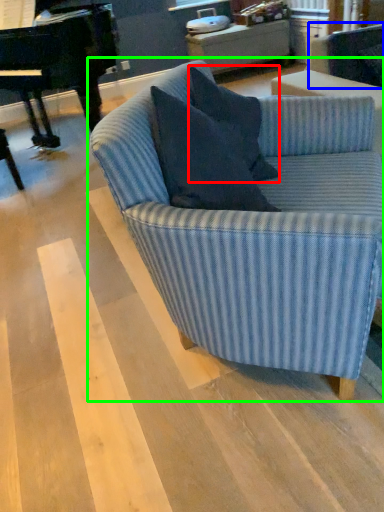
Question: Considering the real-world distances, which object is closest to pillow (highlighted by a red box)? swivel chair (highlighted by a blue box) or studio couch (highlighted by a green box).

Choices:
 (A) swivel chair
 (B) studio couch

Answer: (B)